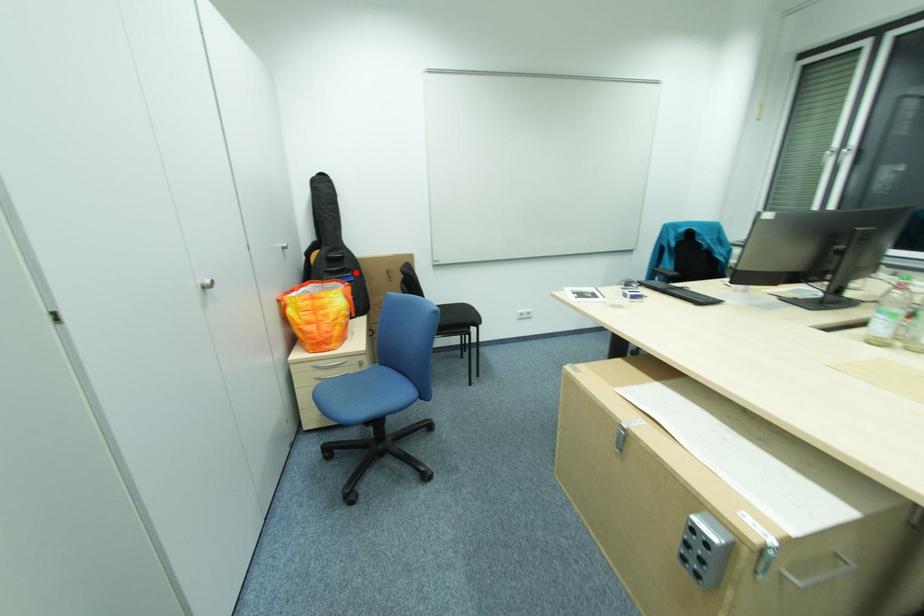
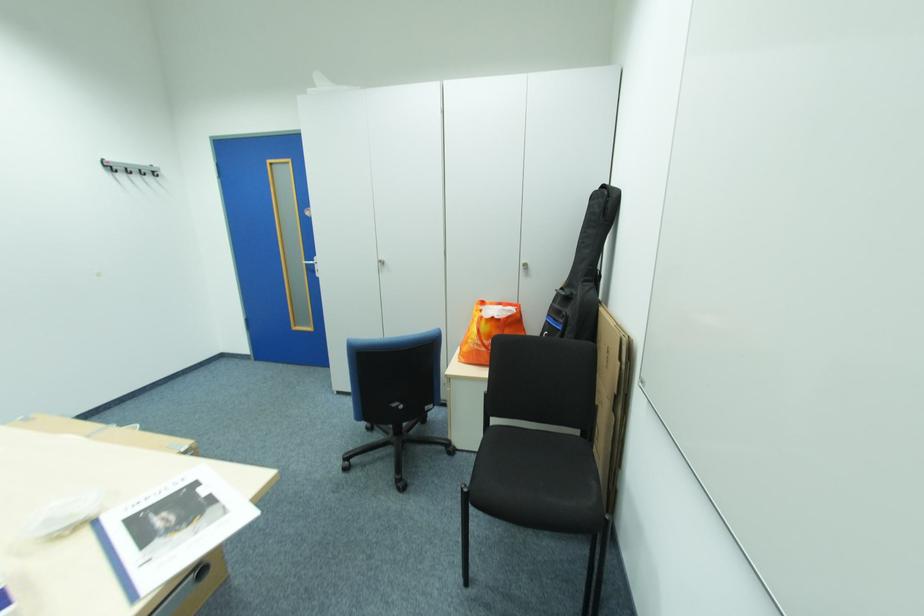
Find the pixel in the second image that matches the highlighted location in the first image.

(572, 318)